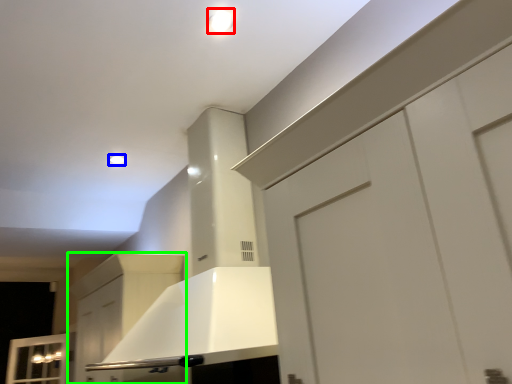
Question: Which object is the closest to the lighting (highlighted by a red box)? Choose among these: lighting (highlighted by a blue box) or cabinetry (highlighted by a green box).

Choices:
 (A) lighting
 (B) cabinetry

Answer: (A)